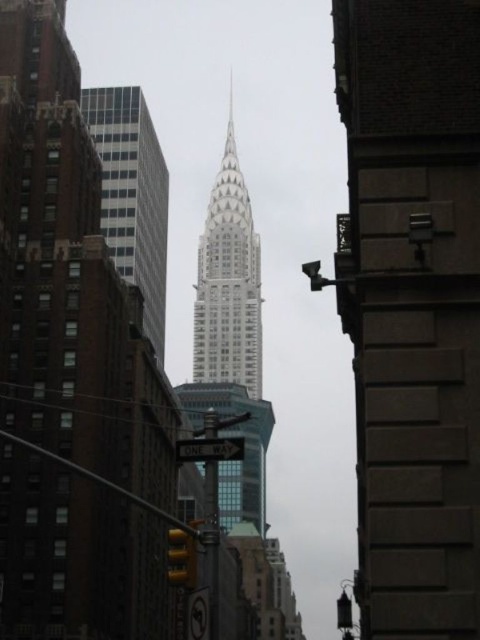
You are a drone operator trying to deliver a package to the top of the glassy steel skyscraper at center. The coordinates provided for the delivery point are point (228, 282). According to the image, is this point likely the correct location for the delivery?

The point (228, 282) marks the glassy steel skyscraper at center, so yes, this point is the correct location for the delivery.

You are standing at the point closest to the camera in the image. Which of the two points, point (215,214) or point (189,566), is farther away from you?

Point (215,214) is behind point (189,566), so it is farther away from you.

You are a tourist standing in the middle of the street looking at the smooth stone tower at center and the glassy steel skyscraper at center. Which one is closer to you?

The smooth stone tower at center is closer to you because it is in front of the glassy steel skyscraper at center.